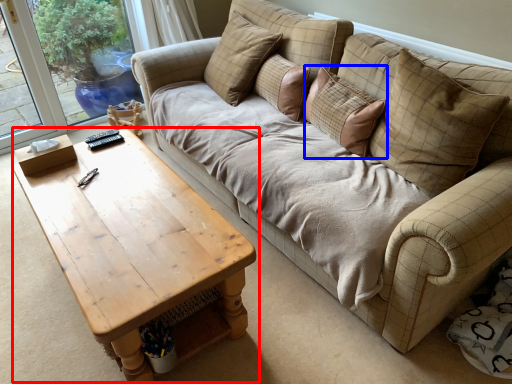
Question: Which of the following is the closest to the observer, coffee table (highlighted by a red box) or pillow (highlighted by a blue box)?

Choices:
 (A) coffee table
 (B) pillow

Answer: (A)